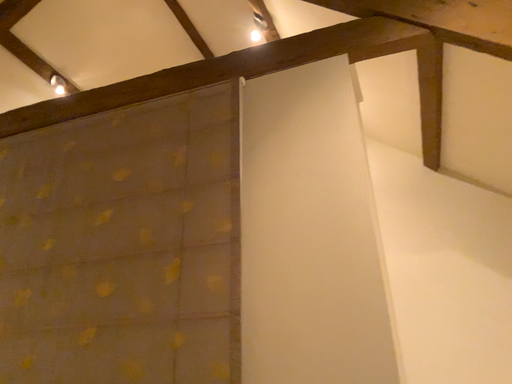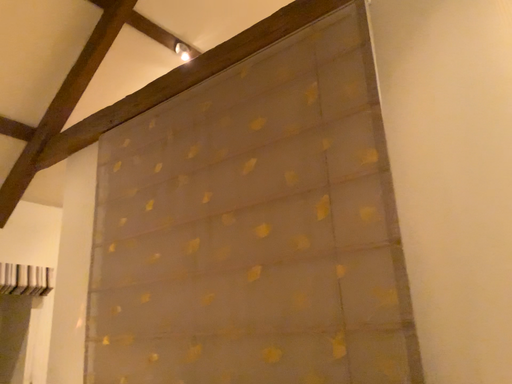
Question: Which way did the camera rotate in the video?

Choices:
 (A) rotated downward
 (B) rotated upward

Answer: (A)